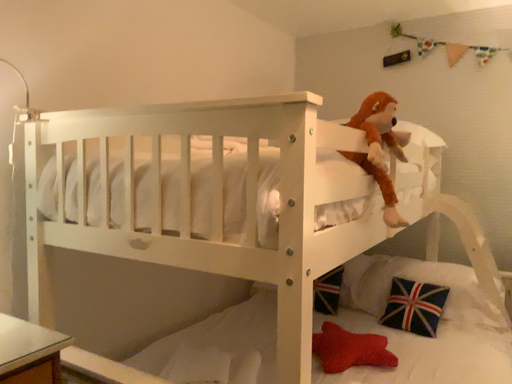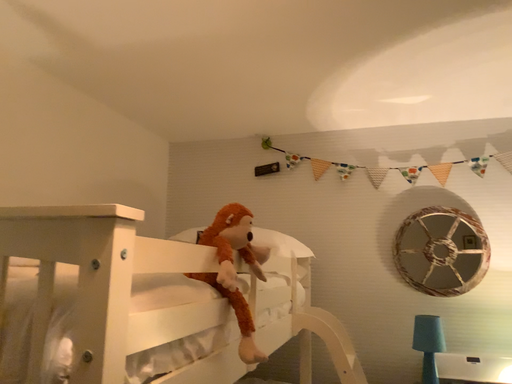
Question: How did the camera likely rotate when shooting the video?

Choices:
 (A) rotated downward
 (B) rotated upward

Answer: (B)